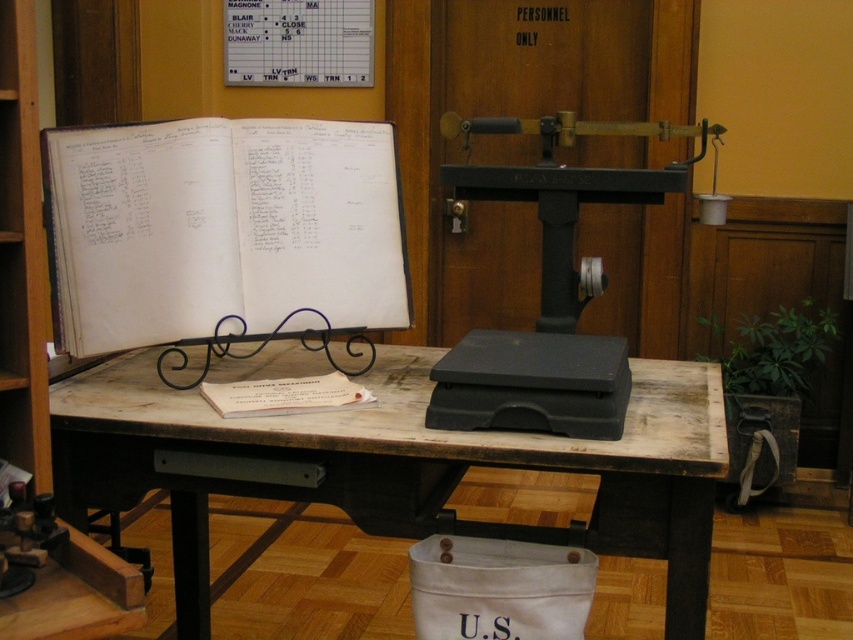
You are standing in front of the vintage desk and notice two points marked on the desk surface. The first point is at coordinates point (45, 426) and the second is at point (350, 385). If you were to walk around the desk, which point would you encounter first when approaching from the front?

Point (45, 426) is in front of point (350, 385), so you would encounter point (45, 426) first when approaching from the front.

You are an office worker needing to place a large document on the desk. The document is wider than the wooden bookshelf at left. Can it fit on the wooden table at center?

The wooden table at center is wider than the wooden bookshelf at left, so the document should fit on the wooden table at center.

You are organizing the office supplies in the vintage workspace. You have a new box of stationery that needs to be placed either on the wooden bookshelf at left or the white paper at center. Based on their sizes, which location can accommodate the box better?

The wooden bookshelf at left is bigger than the white paper at center, so the box of stationery will fit better on the wooden bookshelf at left.